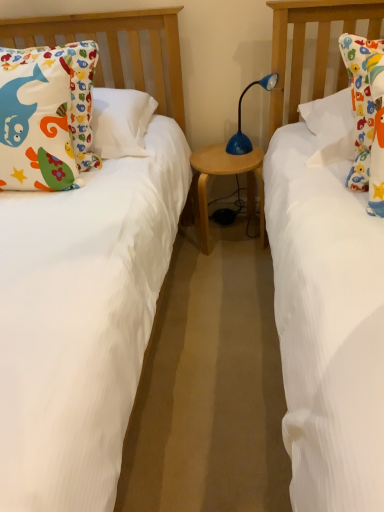
Question: Can you confirm if wooden table at center is shorter than blue plastic table lamp at center?

Choices:
 (A) no
 (B) yes

Answer: (A)

Question: Is the position of wooden table at center less distant than that of blue plastic table lamp at center?

Choices:
 (A) no
 (B) yes

Answer: (A)

Question: Is wooden table at center oriented away from blue plastic table lamp at center?

Choices:
 (A) yes
 (B) no

Answer: (B)

Question: From the image's perspective, does wooden table at center appear higher than blue plastic table lamp at center?

Choices:
 (A) yes
 (B) no

Answer: (B)

Question: Is wooden table at center positioned beyond the bounds of blue plastic table lamp at center?

Choices:
 (A) no
 (B) yes

Answer: (B)

Question: Does wooden table at center have a greater width compared to blue plastic table lamp at center?

Choices:
 (A) yes
 (B) no

Answer: (A)

Question: Is wooden table at center oriented towards matte cotton pillow at left?

Choices:
 (A) yes
 (B) no

Answer: (B)

Question: Does wooden table at center have a larger size compared to matte cotton pillow at left?

Choices:
 (A) no
 (B) yes

Answer: (A)

Question: Is wooden table at center turned away from matte cotton pillow at left?

Choices:
 (A) yes
 (B) no

Answer: (B)

Question: Can you confirm if wooden table at center is thinner than matte cotton pillow at left?

Choices:
 (A) no
 (B) yes

Answer: (A)

Question: Is wooden table at center surrounding matte cotton pillow at left?

Choices:
 (A) yes
 (B) no

Answer: (B)

Question: From the image's perspective, is wooden table at center beneath matte cotton pillow at left?

Choices:
 (A) no
 (B) yes

Answer: (B)

Question: From the image's perspective, is matte cotton pillow at left beneath blue plastic table lamp at center?

Choices:
 (A) yes
 (B) no

Answer: (A)